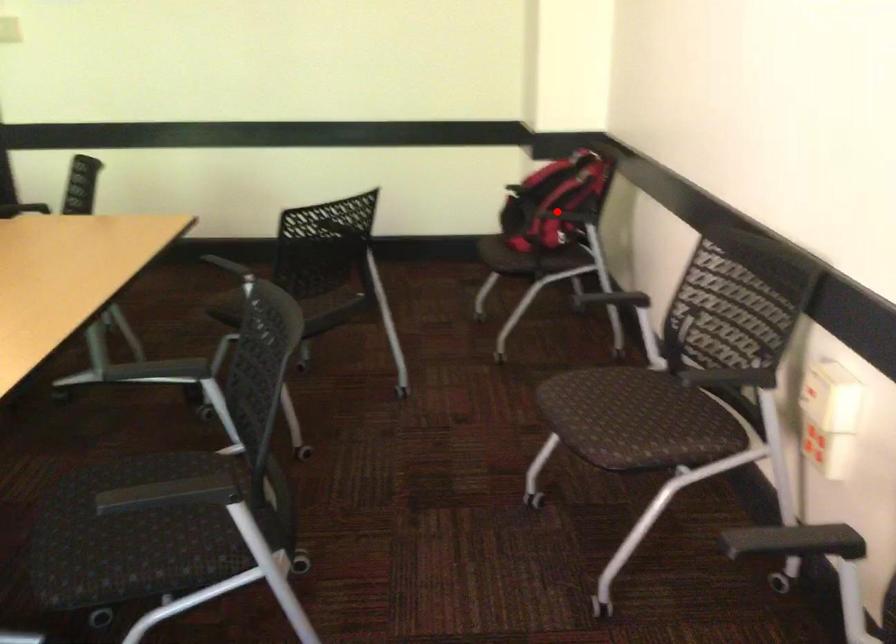
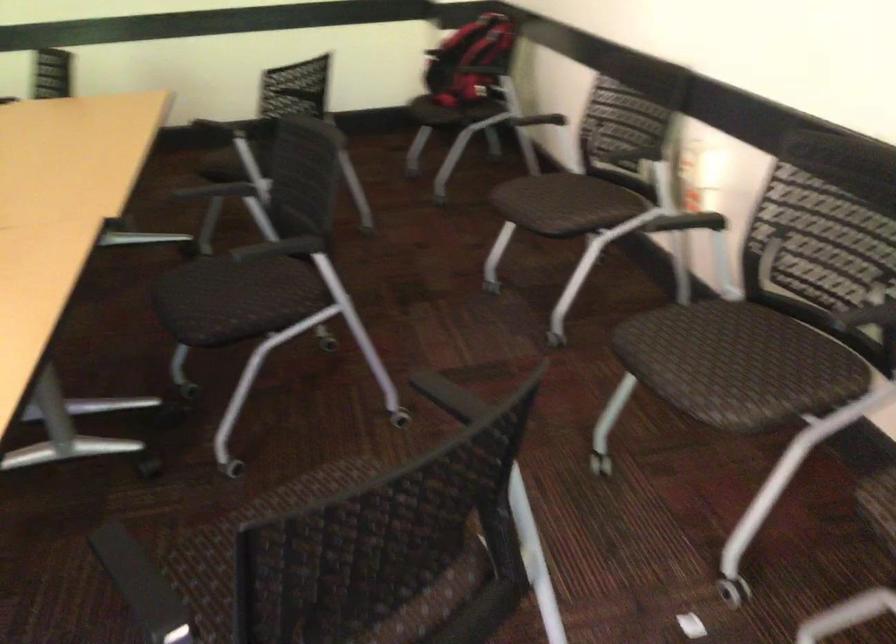
Where in the second image is the point corresponding to the highlighted location from the first image?

(471, 61)